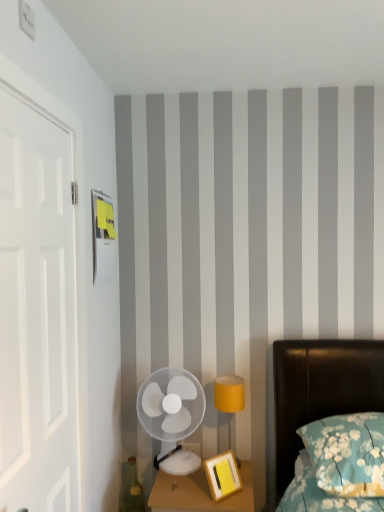
This screenshot has height=512, width=384. Find the location of `matte yellow lampshade at right`. matte yellow lampshade at right is located at coordinates (229, 397).

What is the approximate width of white matte door at left?

It is 13.47 centimeters.

This screenshot has width=384, height=512. Find the location of `white matte door at left`. white matte door at left is located at coordinates (37, 312).

Based on the photo, measure the distance between white plastic fan at lower left and camera.

2.01 meters.

The height and width of the screenshot is (512, 384). I want to click on teal floral pillow at lower right, so click(x=347, y=453).

At what (x,y) coordinates should I click in order to perform the action: click on wooden nightstand at lower center. Please return your answer as a coordinate pair (x, y). This screenshot has width=384, height=512. Looking at the image, I should click on (200, 493).

Between wooden nightstand at lower center and white plastic fan at lower left, which one has smaller width?

white plastic fan at lower left is thinner.

Is the surface of wooden nightstand at lower center in direct contact with white plastic fan at lower left?

No.

From the image's perspective, between wooden nightstand at lower center and white plastic fan at lower left, which one is located above?

Answer: white plastic fan at lower left, from the image's perspective.

Is teal glass bottle at lower left not inside white matte door at left?

Yes, teal glass bottle at lower left is located beyond the bounds of white matte door at left.

Does teal glass bottle at lower left turn towards white matte door at left?

No, teal glass bottle at lower left is not aimed at white matte door at left.

Is point (131, 497) farther from viewer compared to point (66, 176)?

Yes, it is behind point (66, 176).

In the scene shown: Which of these two, teal glass bottle at lower left or white matte door at left, is bigger?

Bigger between the two is white matte door at left.

Which of these two, teal glass bottle at lower left or matte yellow lampshade at right, stands shorter?

matte yellow lampshade at right.

Identify the location of bedside lamp in front of the teal glass bottle at lower left. (229, 397).

Is teal glass bottle at lower left with matte yellow lampshade at right?

No, teal glass bottle at lower left is not next to matte yellow lampshade at right.

Consider the image. Is teal glass bottle at lower left located outside matte yellow lampshade at right?

Yes.

The image size is (384, 512). I want to click on pillow that is in front of the teal glass bottle at lower left, so [x=347, y=453].

Is teal floral pillow at lower right to the left or to the right of teal glass bottle at lower left in the image?

From the image, it's evident that teal floral pillow at lower right is to the right of teal glass bottle at lower left.

Is teal floral pillow at lower right smaller than teal glass bottle at lower left?

Incorrect, teal floral pillow at lower right is not smaller in size than teal glass bottle at lower left.

Is teal glass bottle at lower left at the back of teal floral pillow at lower right?

No, teal floral pillow at lower right's orientation is not away from teal glass bottle at lower left.

Which is farther, (323, 484) or (44, 423)?

→ The point (323, 484) is more distant.

Where is `door lying on the left of teal floral pillow at lower right`? The height and width of the screenshot is (512, 384). door lying on the left of teal floral pillow at lower right is located at coordinates (37, 312).

From the image's perspective, which one is positioned higher, teal floral pillow at lower right or white matte door at left?

white matte door at left, from the image's perspective.

Which is more to the right, teal floral pillow at lower right or white matte door at left?

From the viewer's perspective, teal floral pillow at lower right appears more on the right side.

Considering the relative positions of white plastic fan at lower left and wooden nightstand at lower center in the image provided, is white plastic fan at lower left to the right of wooden nightstand at lower center from the viewer's perspective?

Incorrect, white plastic fan at lower left is not on the right side of wooden nightstand at lower center.

Is white plastic fan at lower left inside the boundaries of wooden nightstand at lower center, or outside?

white plastic fan at lower left is located beyond the bounds of wooden nightstand at lower center.

You are a GUI agent. You are given a task and a screenshot of the screen. Output one action in this format:
    pyautogui.click(x=<x>, y=<y>)
    Task: Click on the mechanical fan on the left of wooden nightstand at lower center
    The width and height of the screenshot is (384, 512).
    Given the screenshot: What is the action you would take?
    pyautogui.click(x=172, y=415)

Does white plastic fan at lower left have a smaller size compared to white matte door at left?

Correct, white plastic fan at lower left occupies less space than white matte door at left.

Which object is closer to the camera, white plastic fan at lower left or white matte door at left?

white matte door at left.

Is white plastic fan at lower left directly adjacent to white matte door at left?

They are not placed beside each other.

Who is taller, white plastic fan at lower left or white matte door at left?

white matte door at left is taller.

Find the location of a particular element. This screenshot has width=384, height=512. mechanical fan behind the wooden nightstand at lower center is located at coordinates (172, 415).

Where is `door positioned vertically above the teal glass bottle at lower left (from a real-world perspective)`? This screenshot has height=512, width=384. door positioned vertically above the teal glass bottle at lower left (from a real-world perspective) is located at coordinates (37, 312).

Estimate the real-world distances between objects in this image. Which object is further from matte yellow lampshade at right, white plastic fan at lower left or teal glass bottle at lower left?

Among the two, teal glass bottle at lower left is located further to matte yellow lampshade at right.

When comparing their distances from white plastic fan at lower left, does matte yellow lampshade at right or white matte door at left seem further?

Among the two, white matte door at left is located further to white plastic fan at lower left.

Considering their positions, is white plastic fan at lower left positioned further to white matte door at left than wooden nightstand at lower center?

Among the two, wooden nightstand at lower center is located further to white matte door at left.

Considering their positions, is teal floral pillow at lower right positioned further to wooden nightstand at lower center than white matte door at left?

Based on the image, white matte door at left appears to be further to wooden nightstand at lower center.

Considering their positions, is white matte door at left positioned further to teal floral pillow at lower right than matte yellow lampshade at right?

white matte door at left lies further to teal floral pillow at lower right than the other object.

Which object lies further to the anchor point teal glass bottle at lower left, white plastic fan at lower left or matte yellow lampshade at right?

Among the two, matte yellow lampshade at right is located further to teal glass bottle at lower left.

Based on the photo, when comparing their distances from matte yellow lampshade at right, does wooden nightstand at lower center or white matte door at left seem further?

white matte door at left lies further to matte yellow lampshade at right than the other object.

Considering their positions, is teal floral pillow at lower right positioned closer to white plastic fan at lower left than white matte door at left?

teal floral pillow at lower right is positioned closer to the anchor white plastic fan at lower left.

The image size is (384, 512). What are the coordinates of `bedside lamp between white plastic fan at lower left and wooden nightstand at lower center from top to bottom` in the screenshot? It's located at (229, 397).

Where is `bedside lamp between white plastic fan at lower left and teal glass bottle at lower left from top to bottom`? The height and width of the screenshot is (512, 384). bedside lamp between white plastic fan at lower left and teal glass bottle at lower left from top to bottom is located at coordinates (229, 397).

The width and height of the screenshot is (384, 512). I want to click on teal situated between white matte door at left and teal floral pillow at lower right from left to right, so coord(131,489).

Find the location of a particular element. The image size is (384, 512). mechanical fan between white matte door at left and teal floral pillow at lower right from left to right is located at coordinates (172, 415).